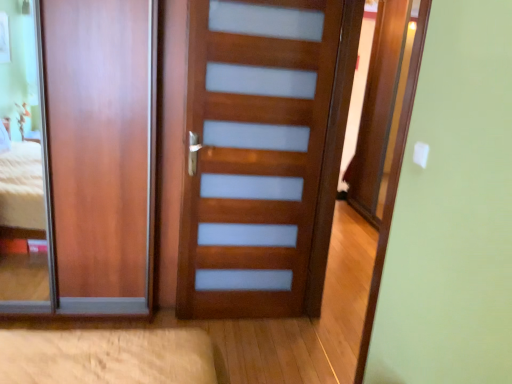
Question: Which direction should I rotate to look at wooden door at center, which appears as the 1th door when viewed from the right, — up or down?

Choices:
 (A) up
 (B) down

Answer: (A)

Question: Does matte wood door at left, the 1th door in the left-to-right sequence, appear on the right side of wooden door at center, which is the second door in left-to-right order?

Choices:
 (A) yes
 (B) no

Answer: (B)

Question: Is the depth of matte wood door at left, the 1th door in the left-to-right sequence, greater than that of wooden door at center, which is the second door in left-to-right order?

Choices:
 (A) no
 (B) yes

Answer: (B)

Question: From the image's perspective, would you say matte wood door at left, the 1th door in the left-to-right sequence, is positioned over wooden door at center, which is the second door in left-to-right order?

Choices:
 (A) yes
 (B) no

Answer: (A)

Question: Could wooden door at center, which appears as the 1th door when viewed from the right, be considered to be inside matte wood door at left, placed as the second door when sorted from right to left?

Choices:
 (A) no
 (B) yes

Answer: (A)

Question: From the image's perspective, is matte wood door at left, placed as the second door when sorted from right to left, below wooden door at center, which appears as the 1th door when viewed from the right?

Choices:
 (A) no
 (B) yes

Answer: (A)

Question: Is matte wood door at left, placed as the second door when sorted from right to left, facing towards wooden door at center, which is the second door in left-to-right order?

Choices:
 (A) yes
 (B) no

Answer: (B)

Question: Considering the relative sizes of wooden door at center, which is the second door in left-to-right order, and matte wood door at left, placed as the second door when sorted from right to left, in the image provided, is wooden door at center, which is the second door in left-to-right order, shorter than matte wood door at left, placed as the second door when sorted from right to left,?

Choices:
 (A) yes
 (B) no

Answer: (B)

Question: From a real-world perspective, is wooden door at center, which is the second door in left-to-right order, beneath matte wood door at left, placed as the second door when sorted from right to left?

Choices:
 (A) yes
 (B) no

Answer: (B)

Question: Is wooden door at center, which appears as the 1th door when viewed from the right, located outside matte wood door at left, placed as the second door when sorted from right to left?

Choices:
 (A) no
 (B) yes

Answer: (B)

Question: Is wooden door at center, which appears as the 1th door when viewed from the right, next to matte wood door at left, placed as the second door when sorted from right to left?

Choices:
 (A) no
 (B) yes

Answer: (A)

Question: From a real-world perspective, is wooden door at center, which appears as the 1th door when viewed from the right, positioned over matte wood door at left, the 1th door in the left-to-right sequence, based on gravity?

Choices:
 (A) no
 (B) yes

Answer: (B)

Question: Is the depth of wooden door at center, which appears as the 1th door when viewed from the right, less than that of matte wood door at left, placed as the second door when sorted from right to left?

Choices:
 (A) no
 (B) yes

Answer: (B)

Question: Considering their positions, is matte wood door at left, the 1th door in the left-to-right sequence, located in front of or behind wooden door at center, which appears as the 1th door when viewed from the right?

Choices:
 (A) behind
 (B) front

Answer: (A)